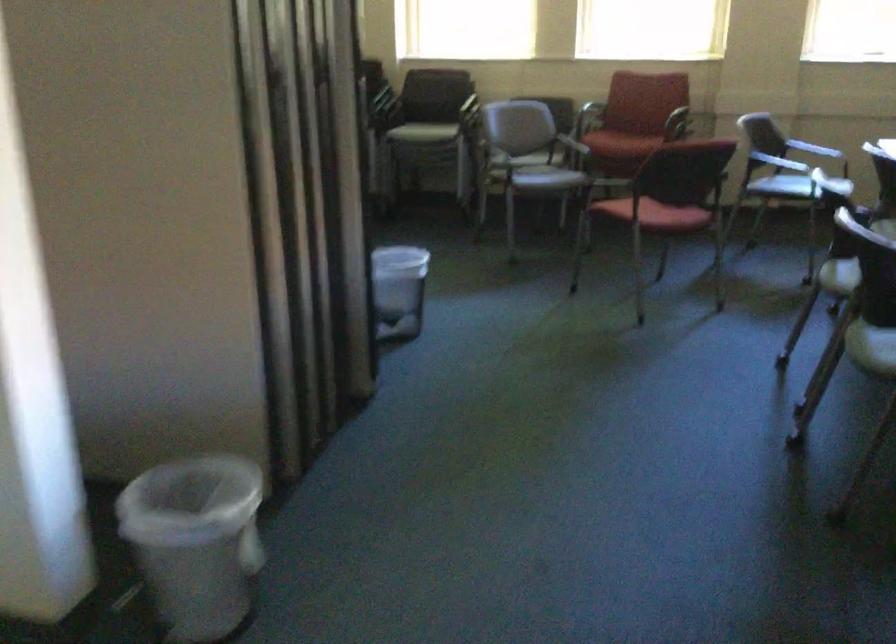
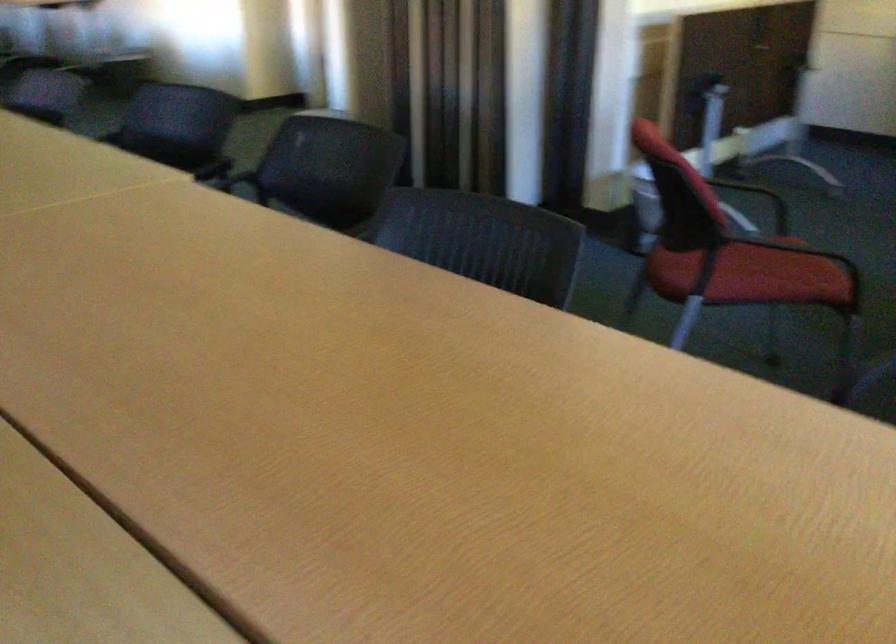
Question: I am providing you with two images of the same scene from different viewpoints. After the viewpoint changes to image2, which objects are now occluded?

Choices:
 (A) black chair armrest
 (B) dark chair sitting surface
 (C) red squeeze bottle
 (D) chair sitting surface

Answer: (D)